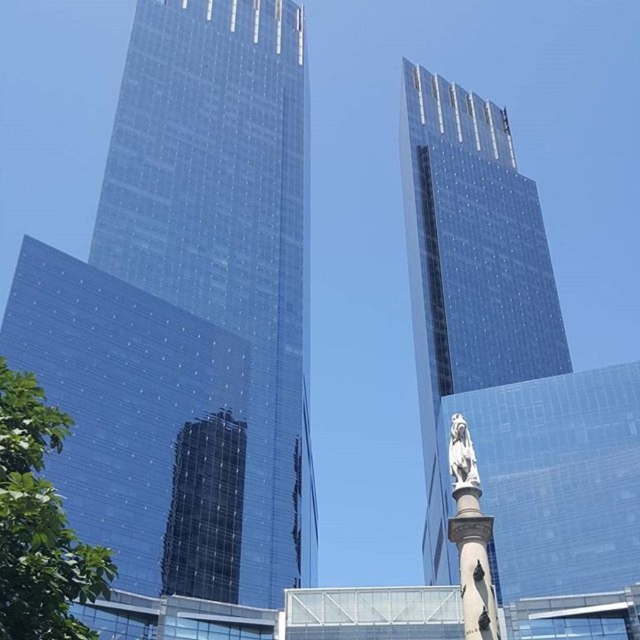
You are standing at the center of the image and want to locate the transparent glass tower at left. According to the coordinates provided, in which direction should you look to find it?

The transparent glass tower at left is located at coordinates point (188, 312). Since you are at the center, looking to the left would align with the tower at those coordinates.

You are an architect analyzing the spatial relationship between two points in the image. Given that point A is at coordinates point (435,209) and point B is at coordinates point (452,428), which point is closer to the viewer?

Point B at point (452,428) is closer to the viewer than point A at point (435,209) because the Objects Description states that point A is behind point B.